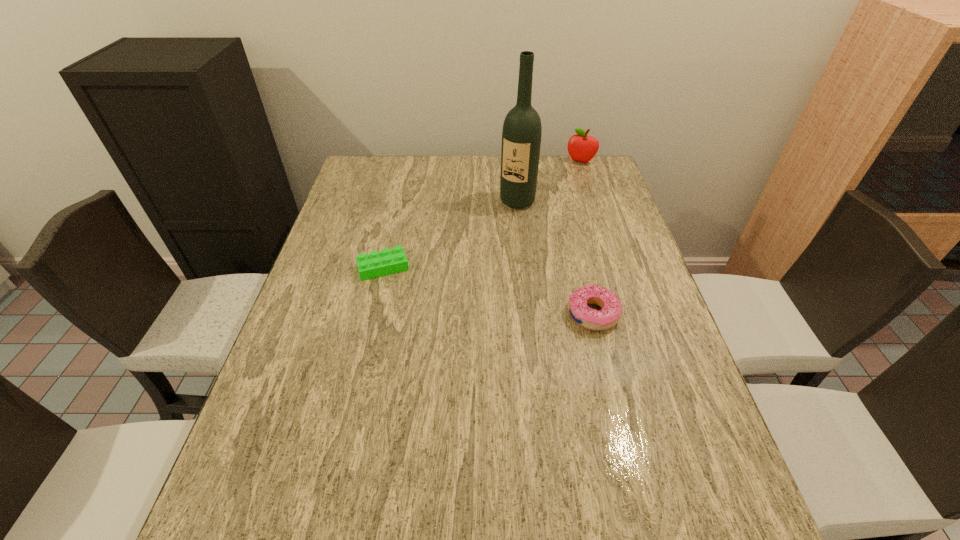
I want to click on vacant space on the desktop that is between the Lego and the nearest object and is positioned on the labeled side of the wine bottle, so click(463, 285).

This screenshot has width=960, height=540. I want to click on free space on the desktop that is between the Lego and the nearest object and is positioned on the front-facing side of the farthest object, so click(504, 295).